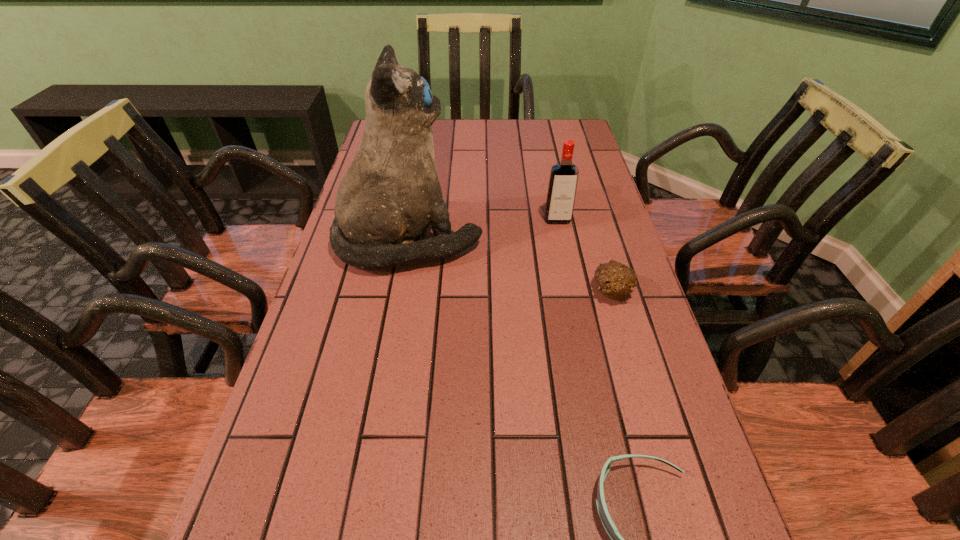
Where is `free space that satisfies the following two spatial constraints: 1. on the back side of the second shortest object; 2. at the face of the tallest object`? This screenshot has height=540, width=960. free space that satisfies the following two spatial constraints: 1. on the back side of the second shortest object; 2. at the face of the tallest object is located at coordinates pos(597,241).